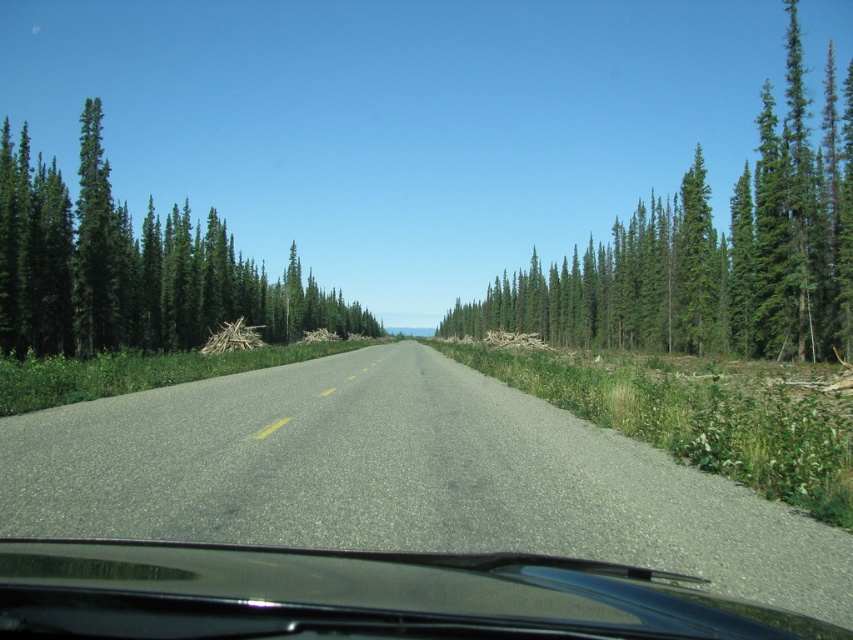
Is asphalt road at center shorter than green coniferous trees at left?

Yes.

Does point (451, 413) come farther from viewer compared to point (96, 202)?

No, it is in front of (96, 202).

Where is `asphalt road at center`? This screenshot has width=853, height=640. asphalt road at center is located at coordinates tap(401, 477).

Is green coniferous trees at right bigger than green coniferous trees at left?

Indeed, green coniferous trees at right has a larger size compared to green coniferous trees at left.

Who is positioned more to the left, green coniferous trees at right or green coniferous trees at left?

green coniferous trees at left is more to the left.

Between point (840, 307) and point (157, 337), which one is positioned behind?

Point (157, 337)

Where is `green coniferous trees at right`? The width and height of the screenshot is (853, 640). green coniferous trees at right is located at coordinates (711, 252).

Is black glossy windshield wiper at center to the left of green coniferous trees at right from the viewer's perspective?

Correct, you'll find black glossy windshield wiper at center to the left of green coniferous trees at right.

Can you confirm if black glossy windshield wiper at center is positioned to the right of green coniferous trees at right?

No, black glossy windshield wiper at center is not to the right of green coniferous trees at right.

Where is `black glossy windshield wiper at center`? black glossy windshield wiper at center is located at coordinates pyautogui.click(x=358, y=595).

At what (x,y) coordinates should I click in order to perform the action: click on black glossy windshield wiper at center. Please return your answer as a coordinate pair (x, y). This screenshot has width=853, height=640. Looking at the image, I should click on click(358, 595).